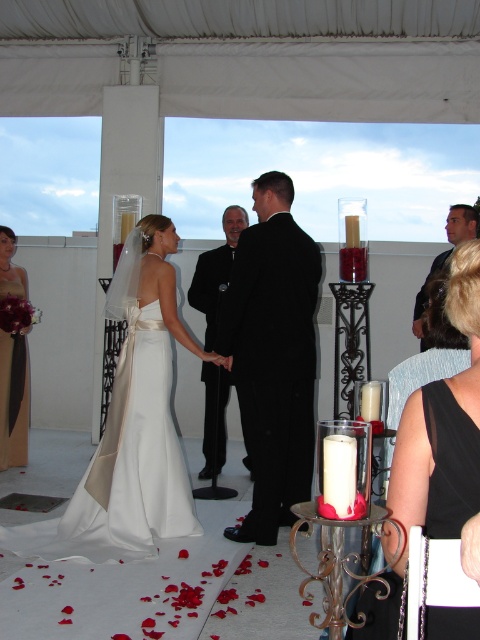
Which is in front, point (298, 392) or point (470, 209)?

Point (298, 392) is more forward.

Is point (287, 310) closer to camera compared to point (465, 237)?

Yes, point (287, 310) is closer to viewer.

Describe the element at coordinates (273, 355) in the screenshot. This screenshot has width=480, height=640. I see `black satin suit at center` at that location.

What are the coordinates of `black satin suit at center` in the screenshot? It's located at (273, 355).

Can you confirm if black satin dress at lower right is wider than silky satin dress at left?

Correct, the width of black satin dress at lower right exceeds that of silky satin dress at left.

How much distance is there between black satin dress at lower right and silky satin dress at left?

black satin dress at lower right and silky satin dress at left are 3.82 meters apart.

At what (x,y) coordinates should I click in order to perform the action: click on black satin dress at lower right. Please return your answer as a coordinate pair (x, y). Looking at the image, I should click on point(444,426).

I want to click on black satin dress at lower right, so click(444, 426).

Between satin/crepe dress at center and black satin dress at lower right, which one is positioned lower?

Positioned lower is satin/crepe dress at center.

Describe the element at coordinates (131, 426) in the screenshot. The width and height of the screenshot is (480, 640). I see `satin/crepe dress at center` at that location.

What do you see at coordinates (131, 426) in the screenshot?
I see `satin/crepe dress at center` at bounding box center [131, 426].

I want to click on satin/crepe dress at center, so click(131, 426).